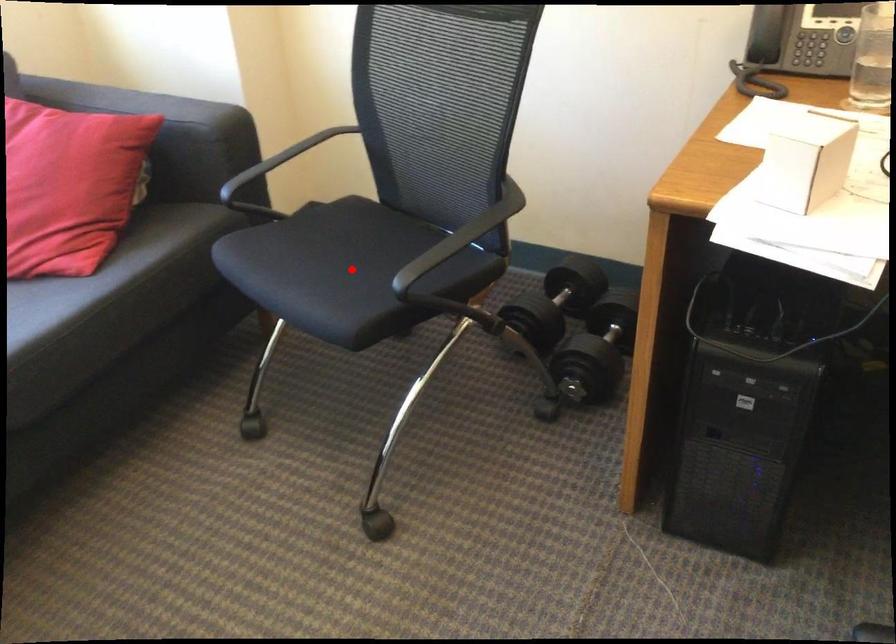
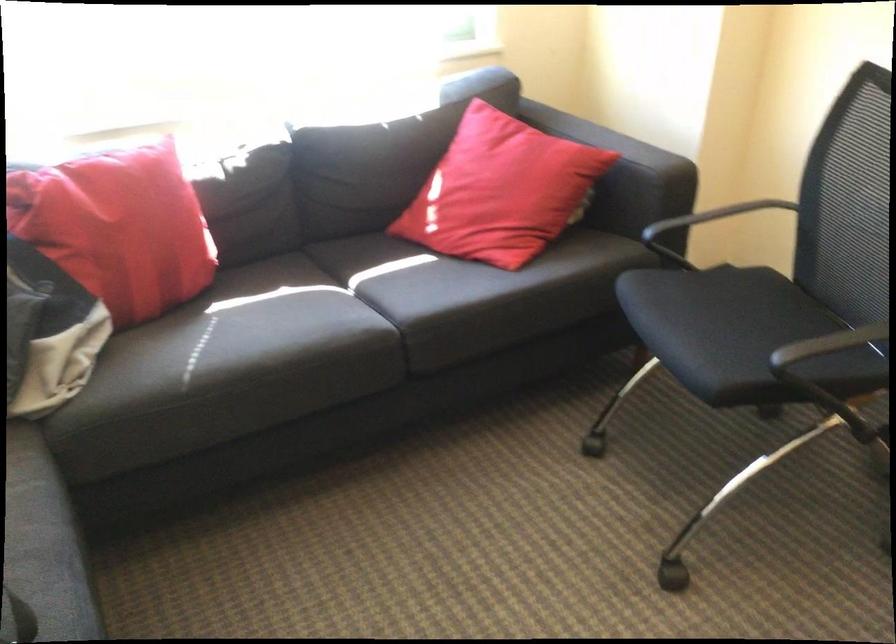
Locate, in the second image, the point that corresponds to the highlighted location in the first image.

(737, 333)